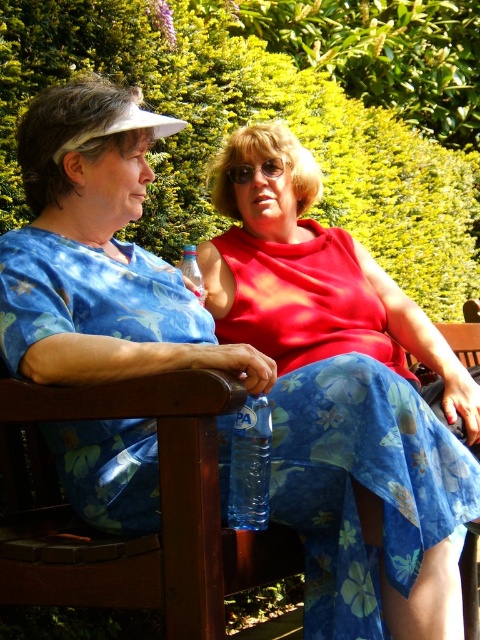
Question: Which object appears closest to the camera in this image?

Choices:
 (A) clear plastic bottle at center
 (B) transparent plastic bottle at center

Answer: (B)

Question: Which point is farther from the camera taking this photo?

Choices:
 (A) (196, 289)
 (B) (254, 416)

Answer: (A)

Question: Which point appears farthest from the camera in this image?

Choices:
 (A) (266, 499)
 (B) (182, 262)

Answer: (B)

Question: Is transparent plastic bottle at center to the left of clear plastic bottle at center from the viewer's perspective?

Choices:
 (A) yes
 (B) no

Answer: (B)

Question: In this image, where is transparent plastic bottle at center located relative to clear plastic bottle at center?

Choices:
 (A) left
 (B) right

Answer: (B)

Question: Is transparent plastic bottle at center to the right of clear plastic bottle at center from the viewer's perspective?

Choices:
 (A) yes
 (B) no

Answer: (A)